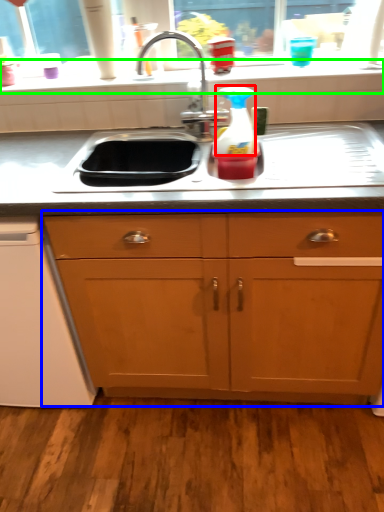
Question: Which is nearer to the appliance (highlighted by a red box)? cabinetry (highlighted by a blue box) or window sill (highlighted by a green box).

Choices:
 (A) cabinetry
 (B) window sill

Answer: (B)